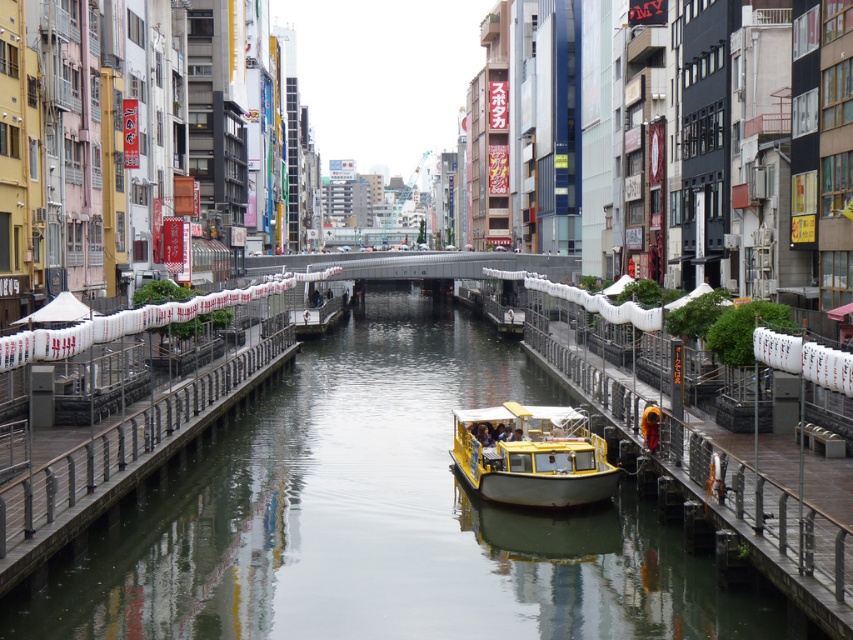
You are standing on the wooden pier near the small yellow and white boat docked on the right side of the canal. Looking across the canal, you see a point marked at coordinates (378, 518). What is located at that point?

The point at coordinates (378, 518) marks the smooth concrete river at center.

Looking at this image, you are standing on the wooden rail at left and want to get to the smooth concrete river at center. Which direction should you move to reach it?

You should move downward from the wooden rail at left to reach the smooth concrete river at center since the smooth concrete river at center is located below the wooden rail at left.

You are standing on the wooden pier next to the small yellow and white boat docked on the right side of the canal. You want to reach the point marked at coordinates (292, 468). Considering the canal is 200 feet wide, can you safely walk across the canal to that point without needing a boat?

The point at coordinates (292, 468) is 183.35 feet away from the viewer. Since the canal is 200 feet wide, the distance to the point is within the canal width, so you can safely walk across the canal to that point without needing a boat.